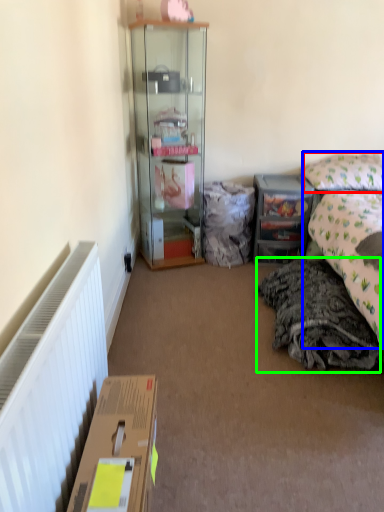
Question: Considering the real-world distances, which object is closest to pillow (highlighted by a red box)? bed (highlighted by a blue box) or material (highlighted by a green box).

Choices:
 (A) bed
 (B) material

Answer: (A)